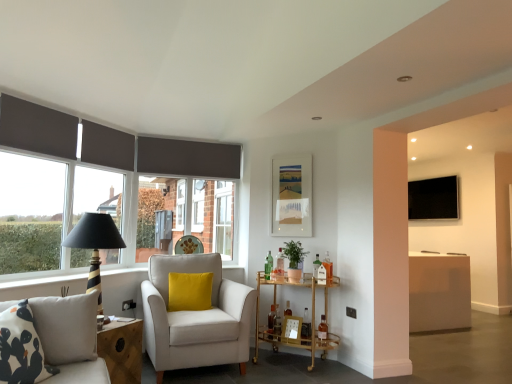
Question: Would you consider wooden picture frame at lower center, the 2th picture frame viewed from the top, to be distant from black striped table lamp at left?

Choices:
 (A) yes
 (B) no

Answer: (A)

Question: Can you confirm if wooden picture frame at lower center, marked as the second picture frame in a back-to-front arrangement, is smaller than black striped table lamp at left?

Choices:
 (A) no
 (B) yes

Answer: (B)

Question: Is wooden picture frame at lower center, the 1th picture frame positioned from the bottom, at the left side of black striped table lamp at left?

Choices:
 (A) yes
 (B) no

Answer: (B)

Question: Is wooden picture frame at lower center, the 2th picture frame viewed from the top, facing away from black striped table lamp at left?

Choices:
 (A) no
 (B) yes

Answer: (A)

Question: Can you confirm if wooden picture frame at lower center, the 2th picture frame viewed from the top, is bigger than black striped table lamp at left?

Choices:
 (A) yes
 (B) no

Answer: (B)

Question: From a real-world perspective, is wooden picture frame at lower center, which is the first picture frame in front-to-back order, physically above black striped table lamp at left?

Choices:
 (A) yes
 (B) no

Answer: (B)

Question: Is black striped table lamp at left shorter than patterned fabric studio couch at lower left?

Choices:
 (A) yes
 (B) no

Answer: (B)

Question: Is black striped table lamp at left behind patterned fabric studio couch at lower left?

Choices:
 (A) no
 (B) yes

Answer: (B)

Question: Is black striped table lamp at left thinner than patterned fabric studio couch at lower left?

Choices:
 (A) yes
 (B) no

Answer: (B)

Question: Is black striped table lamp at left smaller than patterned fabric studio couch at lower left?

Choices:
 (A) no
 (B) yes

Answer: (A)

Question: From the image's perspective, is black striped table lamp at left over patterned fabric studio couch at lower left?

Choices:
 (A) no
 (B) yes

Answer: (B)

Question: Could you tell me if black striped table lamp at left is facing patterned fabric studio couch at lower left?

Choices:
 (A) no
 (B) yes

Answer: (A)

Question: Is patterned fabric studio couch at lower left oriented away from velvet yellow pillow at center?

Choices:
 (A) yes
 (B) no

Answer: (B)